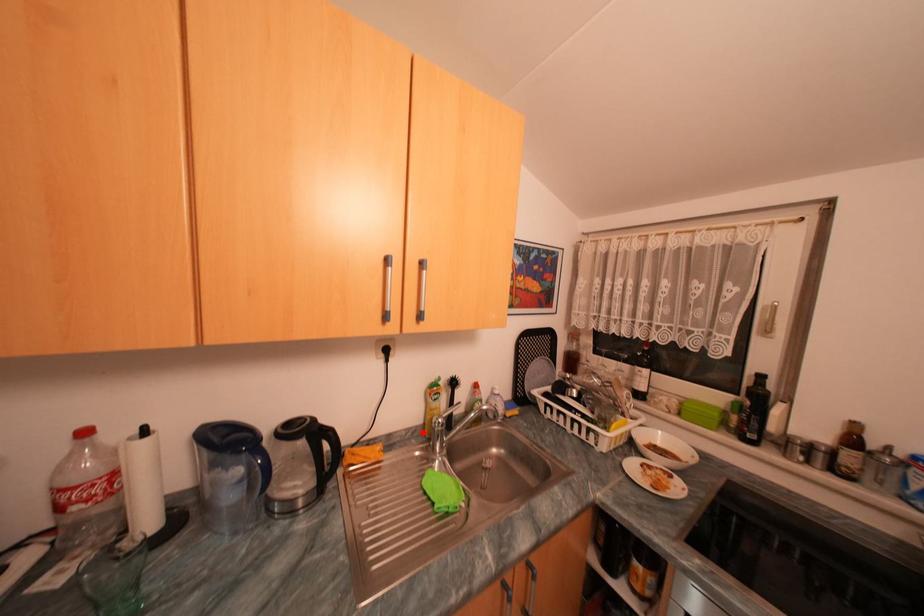
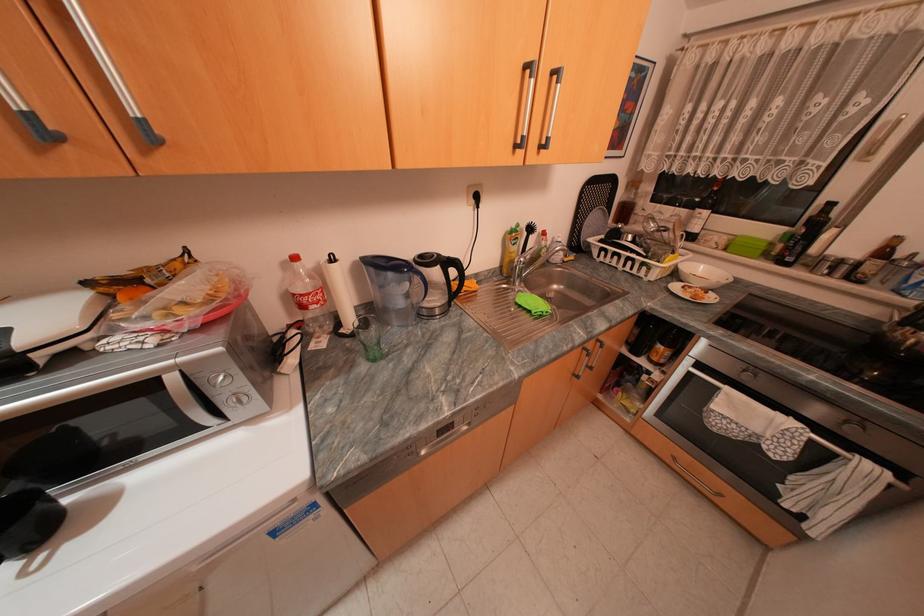
The point at the highlighted location is marked in the first image. Where is the corresponding point in the second image?

(503, 273)